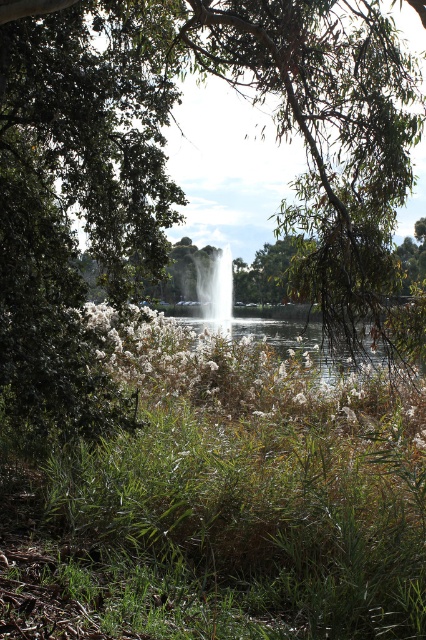
You are standing at the edge of the lake in the scene and want to take a photo. There are two points of interest marked as point 1 at coordinates point (22, 225) and point 2 at coordinates point (201, 307). Which point should you focus on to ensure it appears larger in your photo?

Point 1 at coordinates point (22, 225) is closer to the camera than point 2 at coordinates point (201, 307). Therefore, focusing on point 1 will make it appear larger in the photo.

You are a photographer standing in the foreground of this outdoor scene. You want to capture a clear shot of the white glossy fountain at center without the green leafy tree at center blocking it. Is there a way to adjust your position to achieve this?

The green leafy tree at center is positioned over the white glossy fountain at center, so moving to the side or adjusting your angle might allow you to capture the fountain without the tree blocking it.